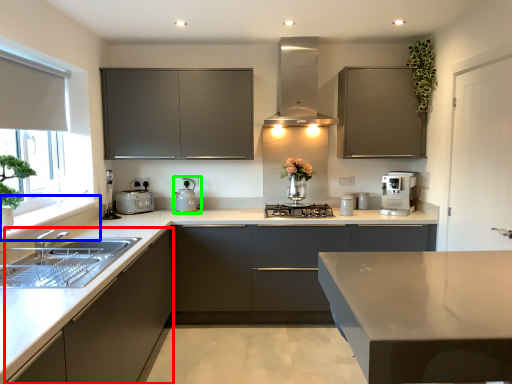
Question: Estimate the real-world distances between objects in this image. Which object is closer to cabinetry (highlighted by a red box), window sill (highlighted by a blue box) or appliance (highlighted by a green box)?

Choices:
 (A) window sill
 (B) appliance

Answer: (A)